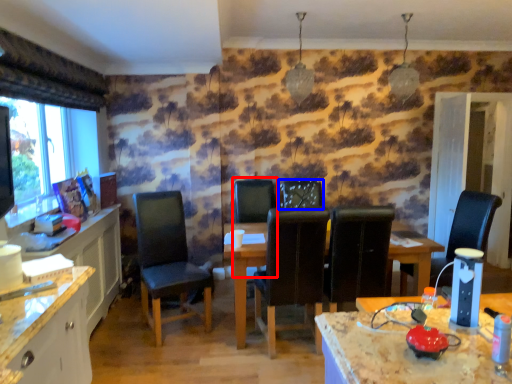
Question: Which of the following is the closest to the observer, armchair (highlighted by a red box) or chair (highlighted by a blue box)?

Choices:
 (A) armchair
 (B) chair

Answer: (B)